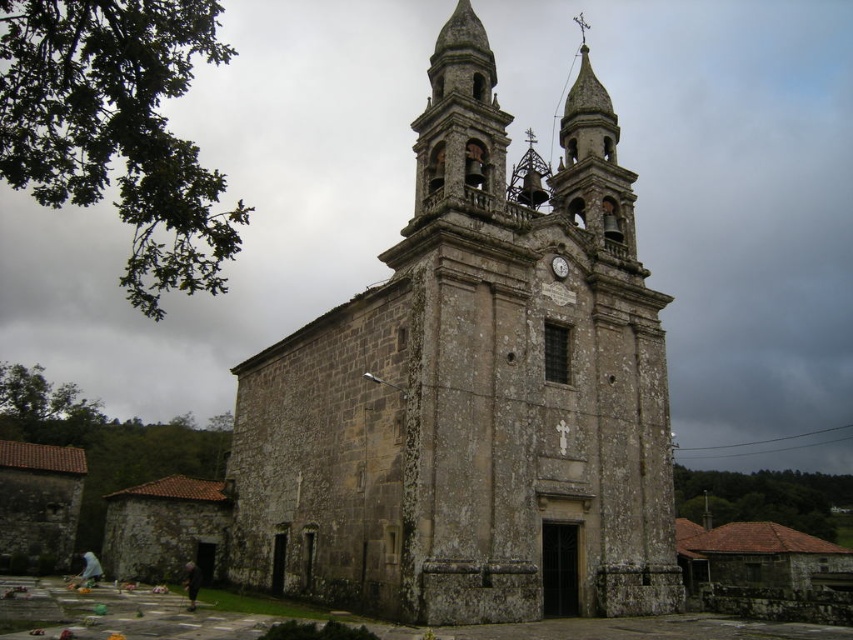
In the scene shown: You are a visitor standing in front of the stone church at center. You notice a metallic clock at center nearby. Which object is wider?

The stone church at center is wider than the metallic clock at center.

You are standing in front of the church and want to know if the metallic clock at center is above or below the stone church at center. According to the scene, can you determine this?

The stone church at center is positioned under the metallic clock at center, so the metallic clock at center is above the stone church at center.

You are standing in front of the church and want to see the metallic clock at center clearly. However, the polished bronze bell at upper center is blocking your view. How can you adjust your position to see the clock?

Since the metallic clock at center is behind the polished bronze bell at upper center, you can move to the side of the bell to get a clear view of the clock.